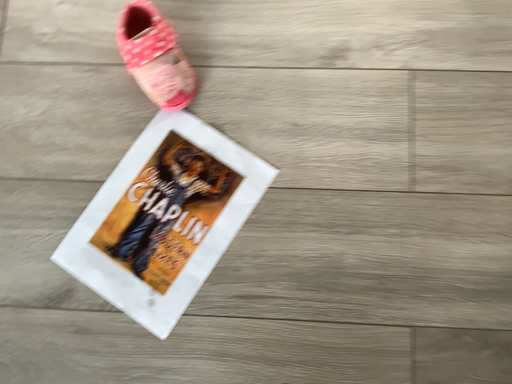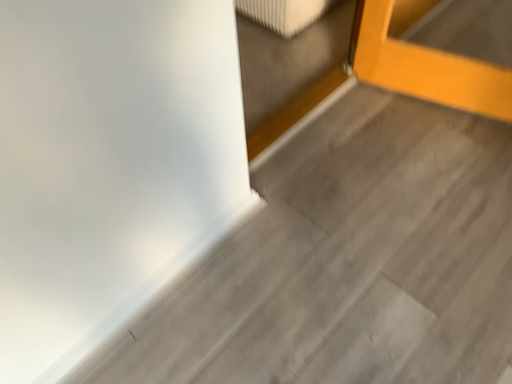
Question: Which way did the camera rotate in the video?

Choices:
 (A) rotated right
 (B) rotated left

Answer: (A)